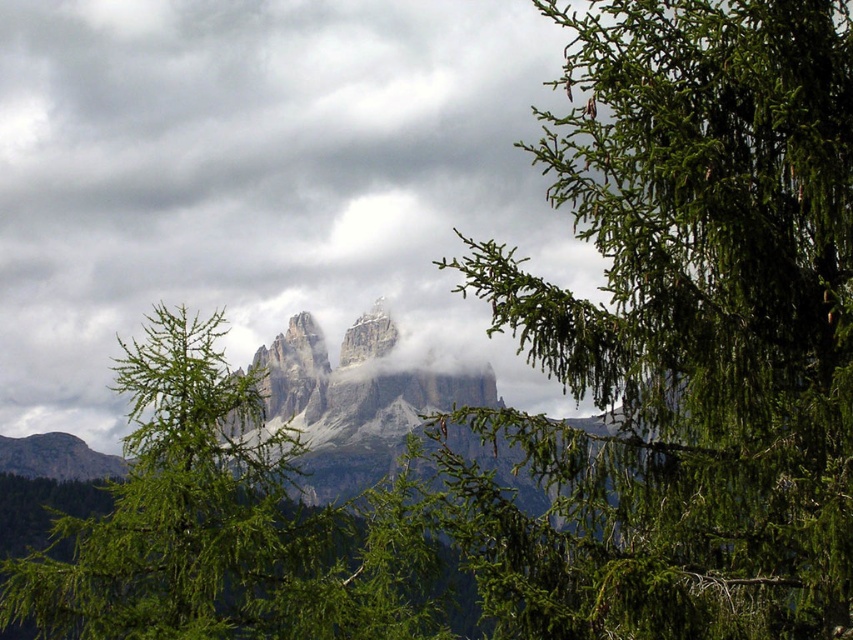
You are standing in the mountain landscape and want to place a small flag at the point marked as point [683,336]. According to the image, where exactly on the scene should you place the flag?

The point [683,336] is located on the green needle like branches at upper right, so you should place the flag there.